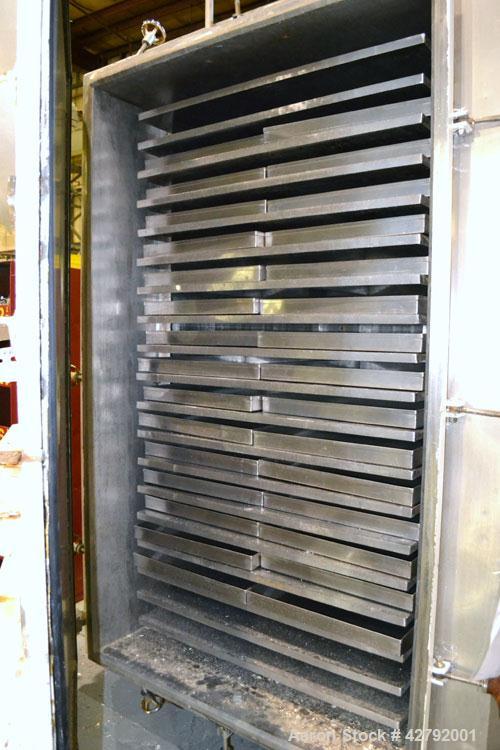
You are a GUI agent. You are given a task and a screenshot of the screen. Output one action in this format:
    pyautogui.click(x=<x>, y=<y>)
    Task: Click on the ceiling
    
    Given the screenshot: What is the action you would take?
    pyautogui.click(x=127, y=16)